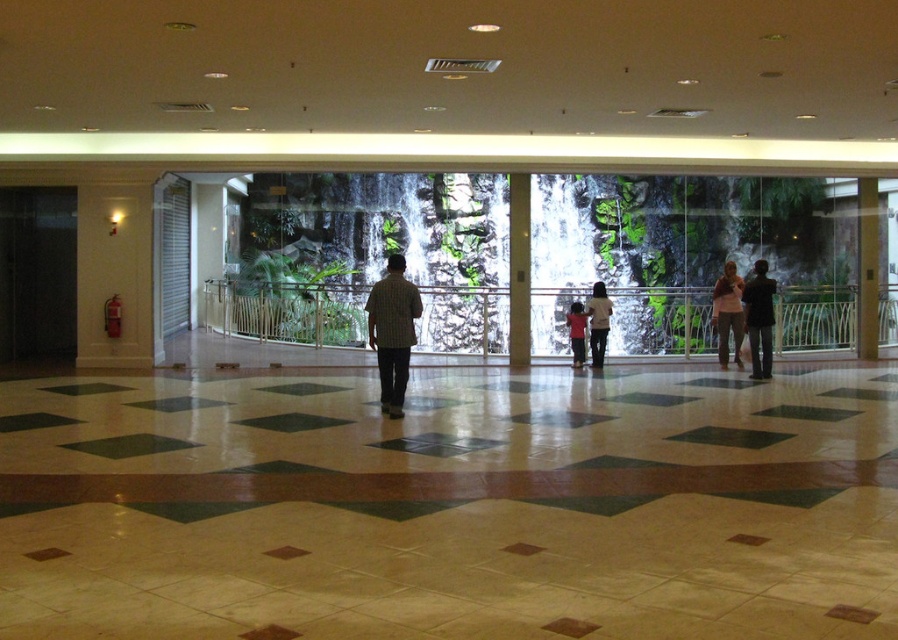
You are planning to install a small shelf on the wall near the brown wood pillar at right and the light pink fabric dress at center. Considering their sizes, which object would allow more space for the shelf above it?

The brown wood pillar at right is much taller than the light pink fabric dress at center, so placing the shelf above the light pink fabric dress at center would leave more vertical space available for the shelf.

You are standing at the entrance of this indoor space and want to reach the green stone pillar at center without getting too close to the light pink fabric dress at center. What should you do?

The green stone pillar at center is 5.28 feet away from the light pink fabric dress at center. To avoid getting too close to the dress, you can walk around either side of the dress while maintaining a safe distance to reach the pillar.